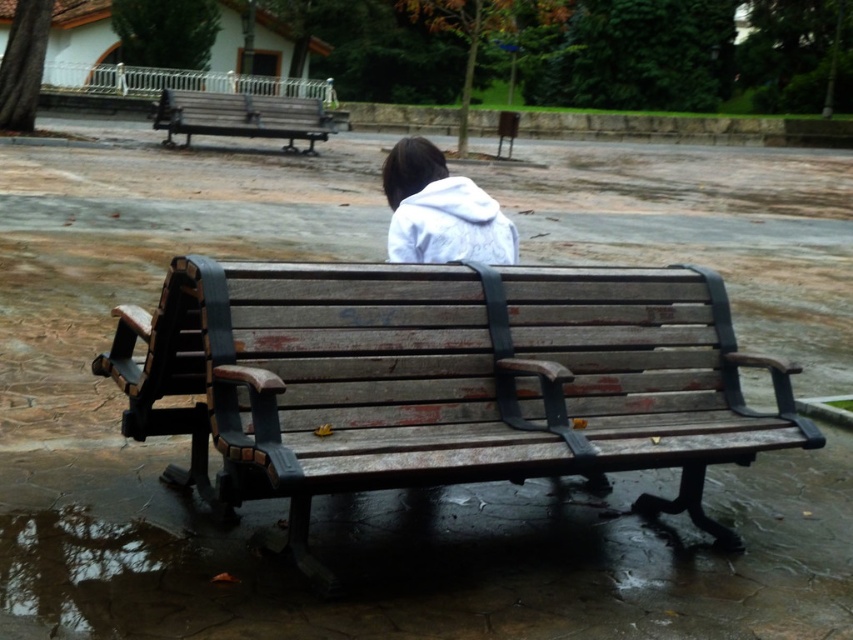
Question: Which of the following is the closest to the observer?

Choices:
 (A) (426, 193)
 (B) (218, 122)

Answer: (A)

Question: From the image, what is the correct spatial relationship of white fleece jacket at center in relation to weathered wood bench at upper left?

Choices:
 (A) right
 (B) left

Answer: (A)

Question: Which of the following is the farthest from the observer?

Choices:
 (A) weathered wood bench at upper left
 (B) white fleece jacket at center

Answer: (A)

Question: Is white fleece jacket at center thinner than weathered wood bench at upper left?

Choices:
 (A) yes
 (B) no

Answer: (A)

Question: Does white fleece jacket at center have a lesser width compared to weathered wood bench at upper left?

Choices:
 (A) no
 (B) yes

Answer: (B)